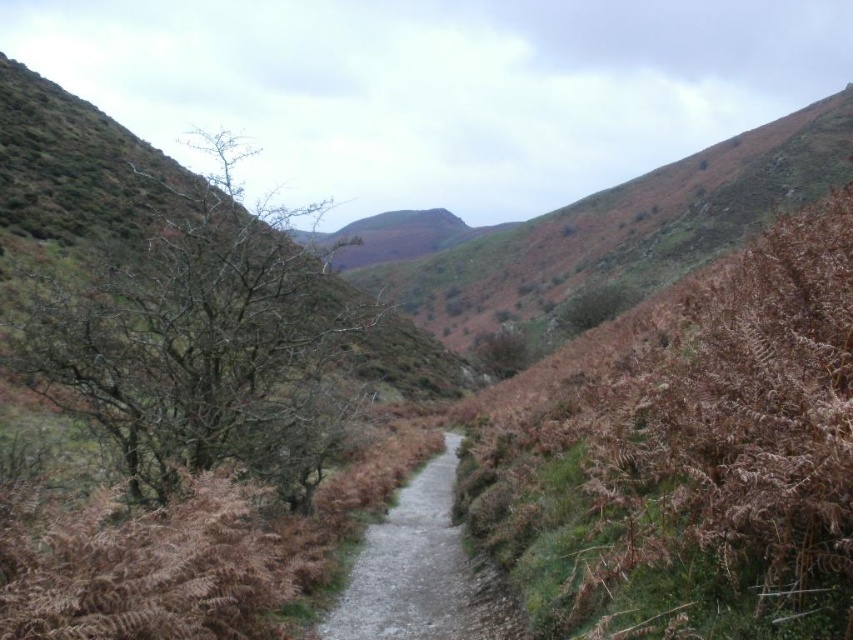
You are standing at the starting point of the path and want to reach the end of the path. Which of the two points, point (233, 420) or point (491, 630), is closer to you as you begin your journey?

Point (233, 420) is closer to you because it is further to the camera than point (491, 630), meaning it is nearer to your starting position.

You are standing at the starting point of the path and notice the bare branches at left. Based on their position, can you determine if they are closer to you or further away compared to other elements in the scene?

The bare branches at left are located at point [200,342], which suggests they are positioned closer to the viewer compared to elements further along the path.